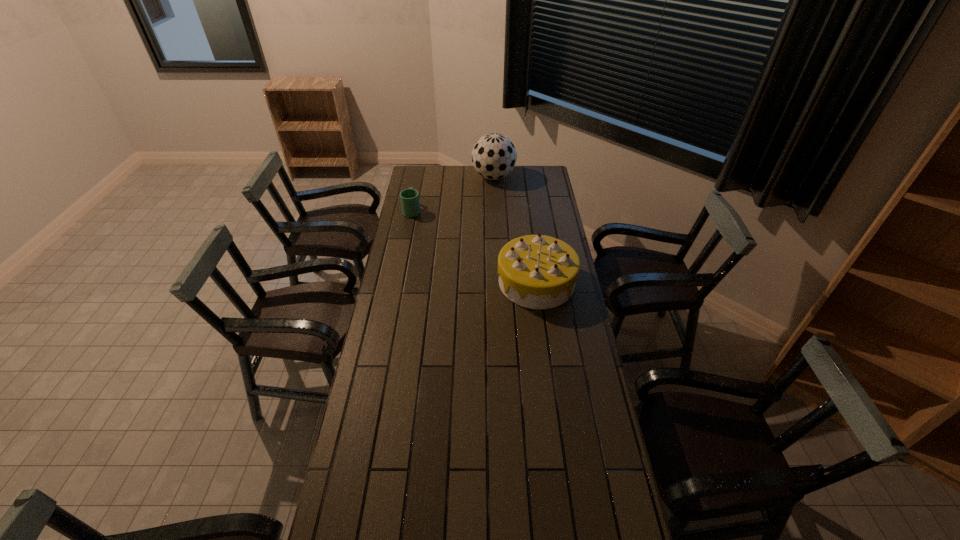
Where is `soccer ball`? The width and height of the screenshot is (960, 540). soccer ball is located at coordinates (494, 156).

I want to click on the farthest object, so click(x=494, y=156).

Image resolution: width=960 pixels, height=540 pixels. What are the coordinates of `the nearest object` in the screenshot? It's located at (535, 271).

Image resolution: width=960 pixels, height=540 pixels. I want to click on birthday cake, so click(535, 271).

Image resolution: width=960 pixels, height=540 pixels. Find the location of `the second farthest object`. the second farthest object is located at coordinates (409, 197).

Image resolution: width=960 pixels, height=540 pixels. In order to click on the shortest object in this screenshot , I will do `click(409, 197)`.

The height and width of the screenshot is (540, 960). I want to click on vacant region located on the left of the farthest object, so click(x=444, y=177).

Where is `free region located on the left of the second shortest object`? free region located on the left of the second shortest object is located at coordinates (434, 282).

This screenshot has height=540, width=960. Identify the location of vacant space situated 0.200m on the side of the leftmost object with the handle. (418, 184).

In order to click on free space located 0.250m on the side of the leftmost object with the handle in this screenshot , I will do `click(419, 179)`.